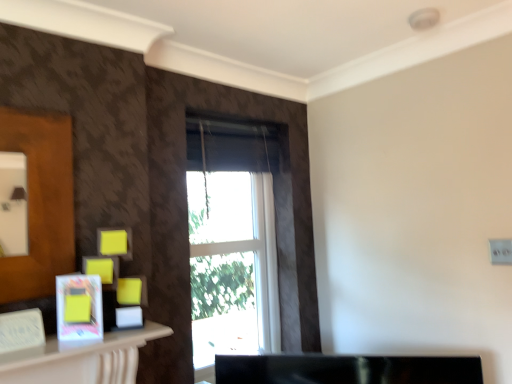
Question: From the image's perspective, is white glass window at center on matte white picture frame at lower left?

Choices:
 (A) no
 (B) yes

Answer: (B)

Question: Is white glass window at center oriented towards matte white picture frame at lower left?

Choices:
 (A) no
 (B) yes

Answer: (A)

Question: Does white glass window at center contain matte white picture frame at lower left?

Choices:
 (A) yes
 (B) no

Answer: (B)

Question: Is white glass window at center closer to camera compared to matte white picture frame at lower left?

Choices:
 (A) yes
 (B) no

Answer: (B)

Question: Does white glass window at center have a lesser height compared to matte white picture frame at lower left?

Choices:
 (A) yes
 (B) no

Answer: (B)

Question: Does white glass window at center have a lesser width compared to matte white picture frame at lower left?

Choices:
 (A) yes
 (B) no

Answer: (B)

Question: Is matte white picture frame at lower left bigger than white glass window at center?

Choices:
 (A) yes
 (B) no

Answer: (B)

Question: Are matte white picture frame at lower left and white glass window at center located far from each other?

Choices:
 (A) no
 (B) yes

Answer: (A)

Question: Is matte white picture frame at lower left shorter than white glass window at center?

Choices:
 (A) yes
 (B) no

Answer: (A)

Question: From the image's perspective, is matte white picture frame at lower left over white glass window at center?

Choices:
 (A) no
 (B) yes

Answer: (A)

Question: Does matte white picture frame at lower left lie behind white glass window at center?

Choices:
 (A) yes
 (B) no

Answer: (B)

Question: Is matte white picture frame at lower left oriented towards white glass window at center?

Choices:
 (A) yes
 (B) no

Answer: (B)

Question: In terms of size, does matte white picture frame at lower left appear bigger or smaller than white glass window at center?

Choices:
 (A) small
 (B) big

Answer: (A)